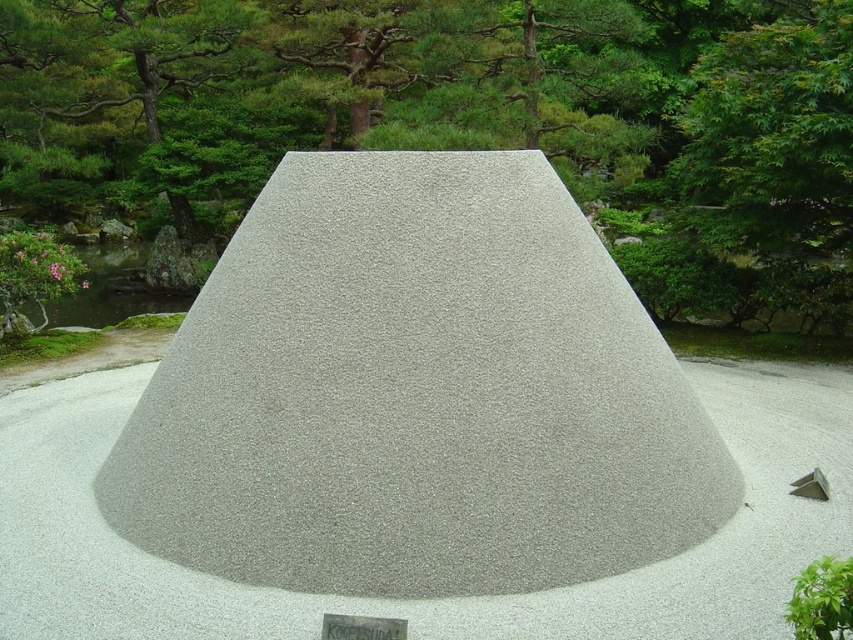
Which of these two, green textured tree at center or gray gravel mound at center, stands taller?

green textured tree at center

Can you confirm if green textured tree at center is smaller than gray gravel mound at center?

No, green textured tree at center is not smaller than gray gravel mound at center.

Who is more distant from viewer, (791, 275) or (782, 600)?

The point (791, 275) is behind.

Find the location of a particular element. green textured tree at center is located at coordinates (451, 106).